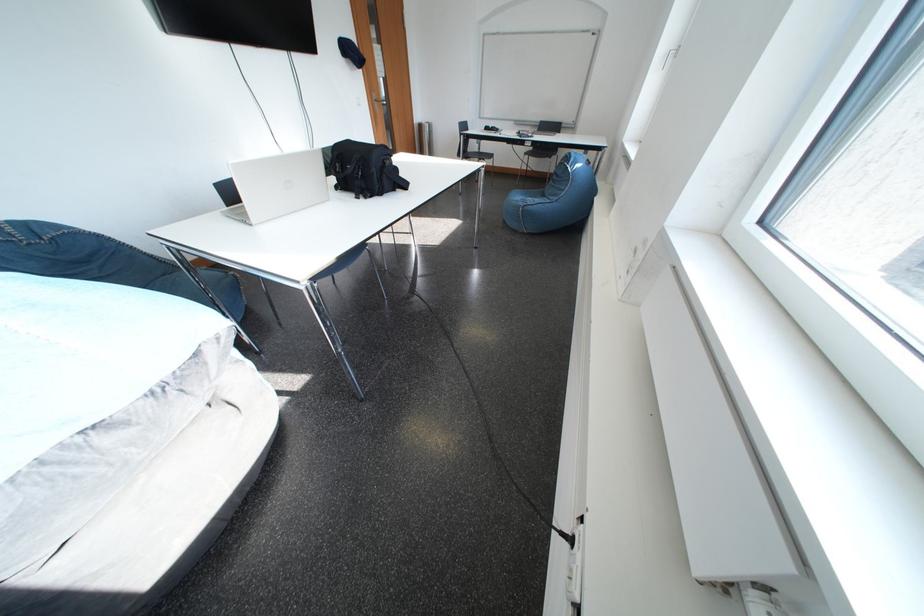
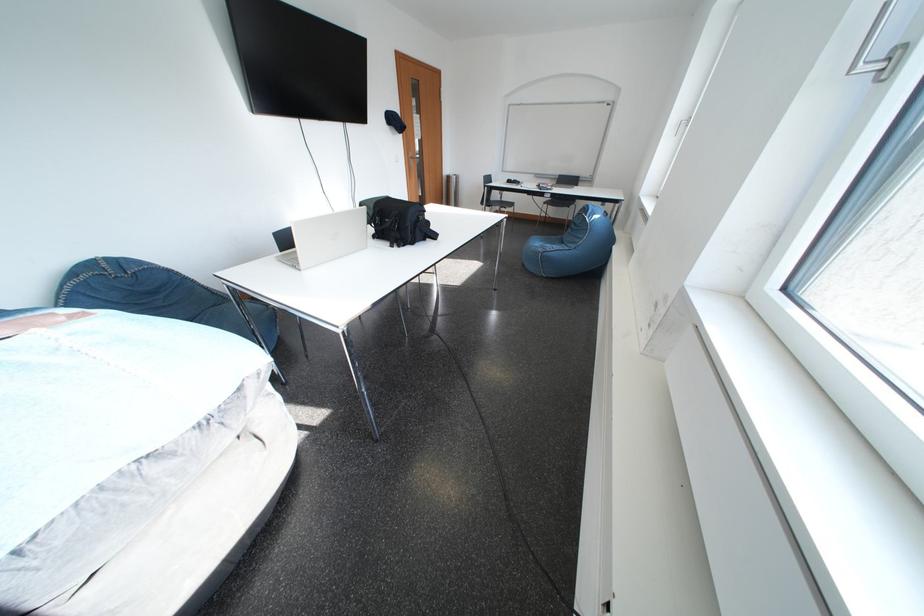
Find the pixel in the second image that matches [393,179] in the first image.

(426, 232)